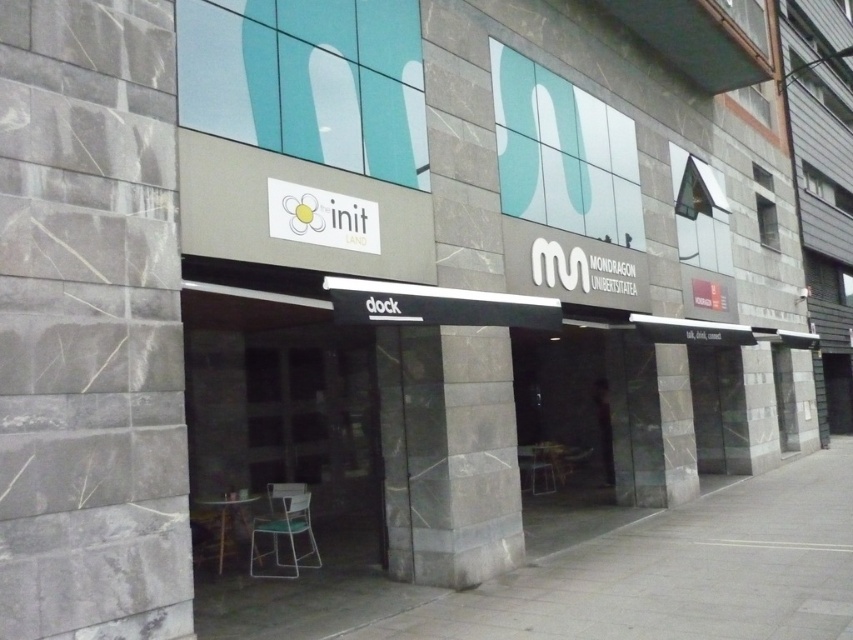
Question: Among these points, which one is farthest from the camera?

Choices:
 (A) (318, 429)
 (B) (535, 449)

Answer: (B)

Question: Which of the following is the farthest from the observer?

Choices:
 (A) (659, 554)
 (B) (291, 493)
 (C) (212, 476)

Answer: (C)

Question: Is gray concrete pavement at lower center to the left of metallic green chair at lower center from the viewer's perspective?

Choices:
 (A) yes
 (B) no

Answer: (B)

Question: Is metallic green chair at lower center to the right of matte plastic chair at center from the viewer's perspective?

Choices:
 (A) no
 (B) yes

Answer: (A)

Question: Estimate the real-world distances between objects in this image. Which object is closer to the matte black door at center?

Choices:
 (A) metallic green chair at lower center
 (B) gray concrete pavement at lower center

Answer: (A)

Question: Can you confirm if gray concrete pavement at lower center is thinner than metallic green chair at lower center?

Choices:
 (A) yes
 (B) no

Answer: (B)